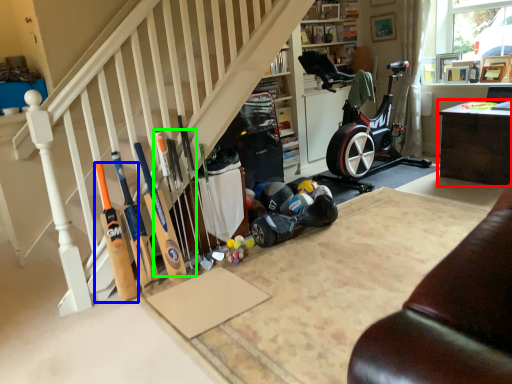
Question: Which object is the farthest from table (highlighted by a red box)? Choose among these: baseball bat (highlighted by a blue box) or baseball bat (highlighted by a green box).

Choices:
 (A) baseball bat
 (B) baseball bat

Answer: (A)